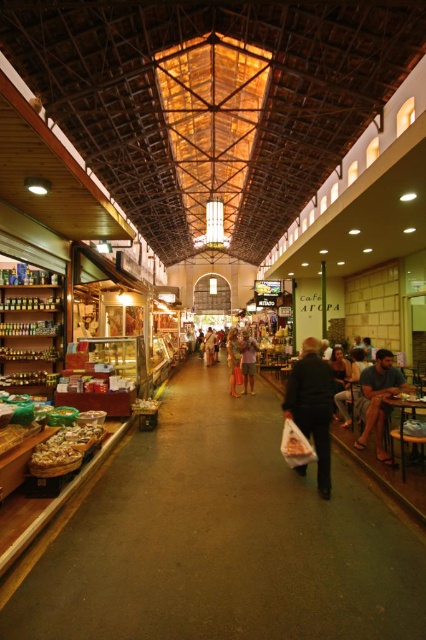
Question: Is dark gray fabric bag at center in front of orange fabric dress at center?

Choices:
 (A) yes
 (B) no

Answer: (A)

Question: Which object is positioned farthest from the light purple fabric shirt at center?

Choices:
 (A) light brown leather shoes at center
 (B) matte brown wooden aisle at center
 (C) dark gray fabric bag at center
 (D) dark blue fabric shirt at right

Answer: (A)

Question: Which object is the closest to the light purple fabric shirt at center?

Choices:
 (A) matte brown wooden aisle at center
 (B) dark blue fabric shirt at right

Answer: (B)

Question: In this image, where is dark blue fabric shirt at right located relative to orange fabric dress at center?

Choices:
 (A) below
 (B) above

Answer: (A)

Question: Where is dark gray fabric bag at center located in relation to dark blue fabric shirt at right in the image?

Choices:
 (A) below
 (B) above

Answer: (B)

Question: Which point appears closest to the camera in this image?

Choices:
 (A) (321, 433)
 (B) (363, 385)
 (C) (207, 349)

Answer: (A)